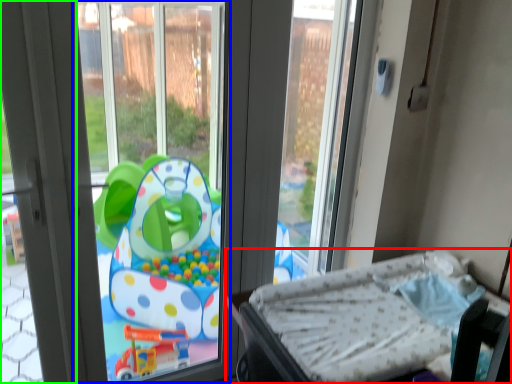
Question: Which object is the farthest from furniture (highlighted by a red box)? Choose among these: window screen (highlighted by a blue box) or screen door (highlighted by a green box).

Choices:
 (A) window screen
 (B) screen door

Answer: (A)